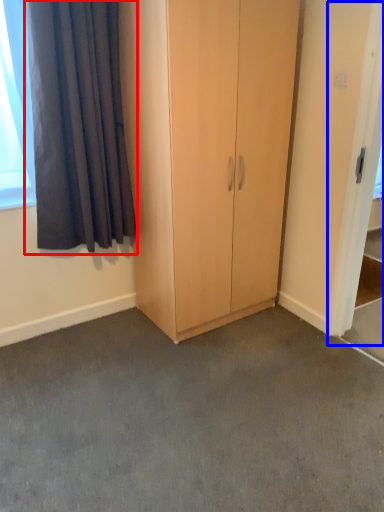
Question: Which of the following is the closest to the observer, curtain (highlighted by a red box) or screen door (highlighted by a blue box)?

Choices:
 (A) curtain
 (B) screen door

Answer: (B)